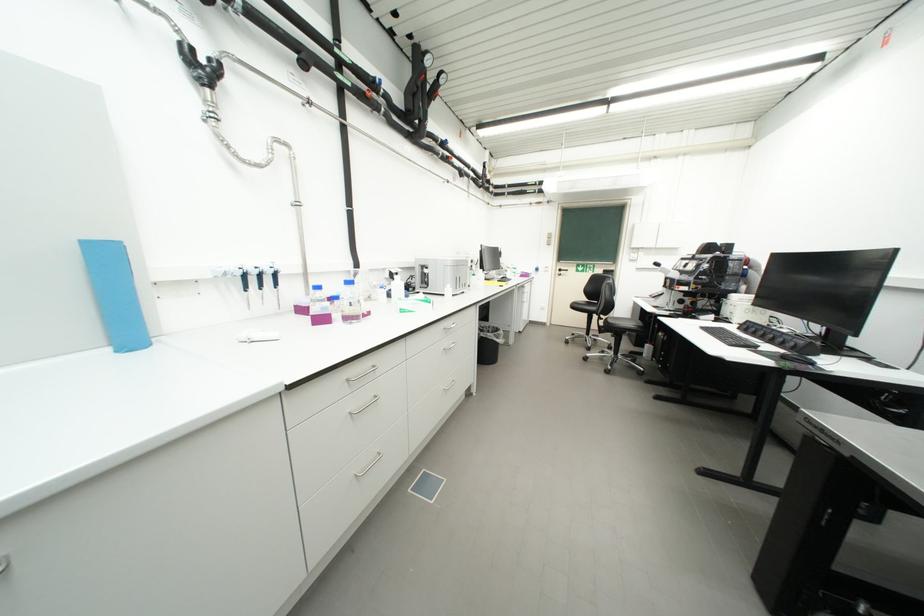
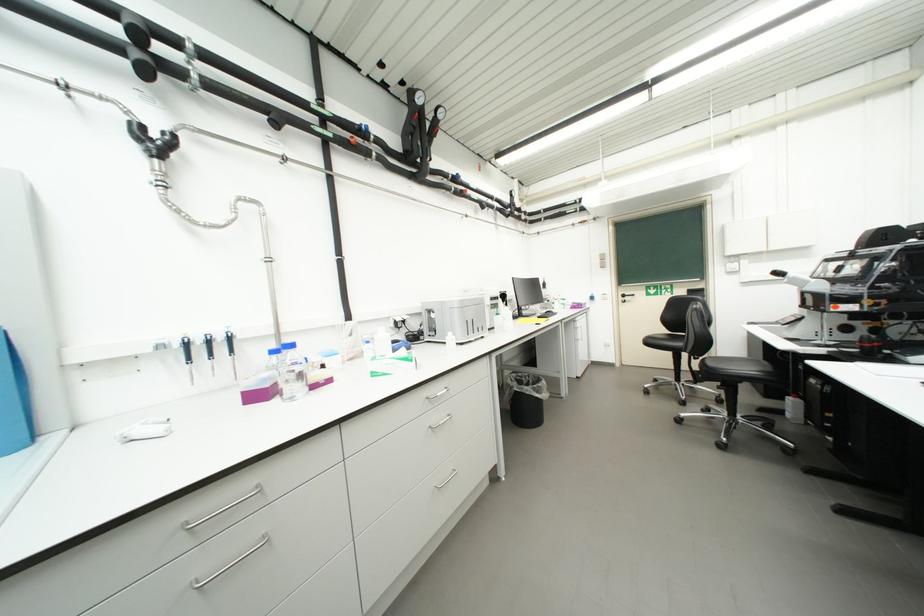
Question: Based on the continuous images, in which direction is the camera rotating? Reply with the corresponding letter.

Choices:
 (A) Left
 (B) Right
 (C) Up
 (D) Down

Answer: (A)